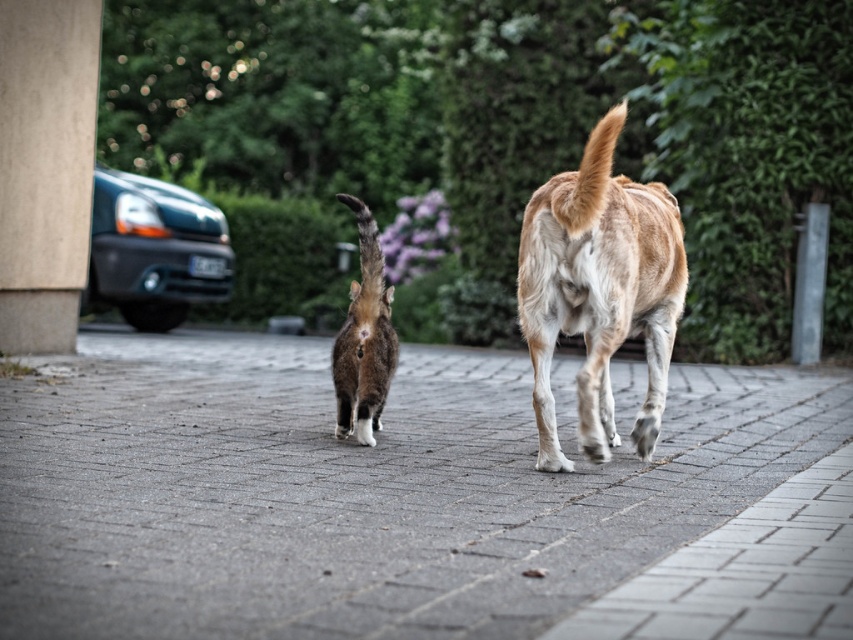
Which is behind, point (61, 70) or point (556, 179)?

The point (61, 70) is more distant.

Is smooth concrete pillar at left in front of light brown fur tail at center?

That is False.

Locate an element on the screen. The image size is (853, 640). smooth concrete pillar at left is located at coordinates (45, 168).

Who is positioned more to the right, light brown fur dog at center or matte black van at left?

Positioned to the right is light brown fur dog at center.

Does light brown fur dog at center have a larger size compared to matte black van at left?

No.

Is point (659, 346) positioned before point (160, 202)?

Yes, it is in front of point (160, 202).

Where is `light brown fur dog at center`? This screenshot has height=640, width=853. light brown fur dog at center is located at coordinates point(599,291).

Can you confirm if soft fur cat at center is smaller than light brown fur tail at center?

No, soft fur cat at center is not smaller than light brown fur tail at center.

Which is in front, point (386, 307) or point (602, 138)?

Point (602, 138) is more forward.

Which is in front, point (344, 368) or point (572, 214)?

Point (572, 214)

Where is `soft fur cat at center`? The image size is (853, 640). soft fur cat at center is located at coordinates (364, 339).